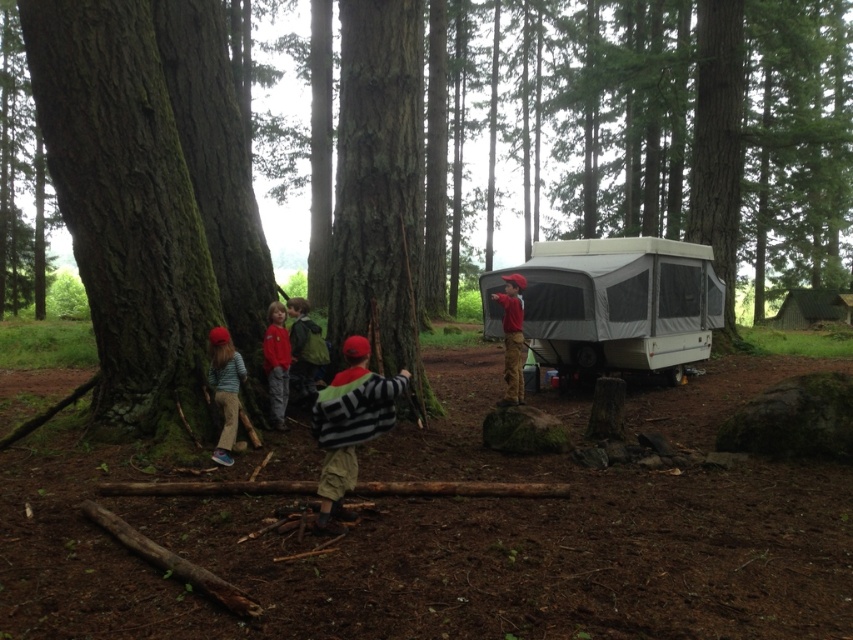
Question: In this image, where is smooth bark tree at center located relative to striped sweater at left?

Choices:
 (A) above
 (B) below

Answer: (A)

Question: From the image, what is the correct spatial relationship of green backpack at center in relation to red cotton shirt at right?

Choices:
 (A) right
 (B) left

Answer: (B)

Question: Does striped sweater at left have a larger size compared to red cotton shirt at right?

Choices:
 (A) yes
 (B) no

Answer: (B)

Question: Based on their relative distances, which object is farther from the green backpack at center?

Choices:
 (A) red cotton shirt at right
 (B) green rough bark tree at center
 (C) smooth bark tree at center

Answer: (B)

Question: Which point is farther to the camera?

Choices:
 (A) red cotton shirt at right
 (B) smooth bark tree at center

Answer: (A)

Question: Based on their relative distances, which object is nearer to the smooth bark tree at center?

Choices:
 (A) green rough bark tree at center
 (B) white mesh recreational vehicle at right
 (C) striped sweater at left
 (D) matte red shirt at center

Answer: (D)